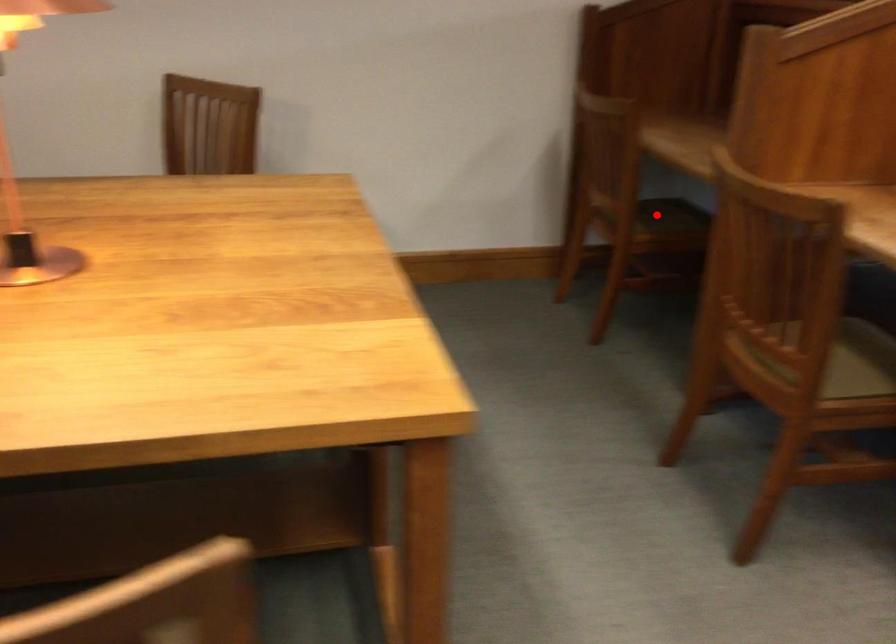
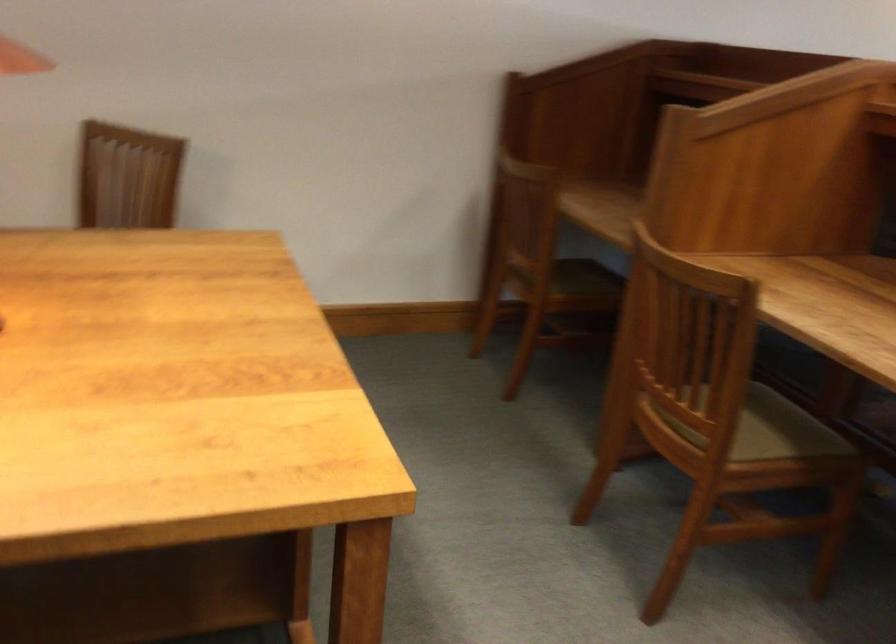
Find the pixel in the second image that matches the highlighted location in the first image.

(572, 277)